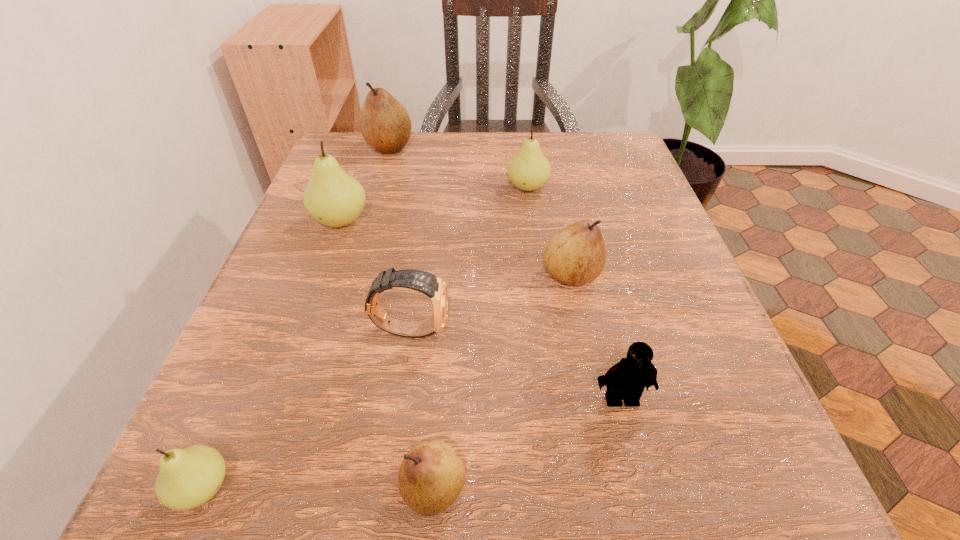
You are a GUI agent. You are given a task and a screenshot of the screen. Output one action in this format:
    pyautogui.click(x=<x>, y=<y>)
    Task: Click on the farthest brown pear
    
    Given the screenshot: What is the action you would take?
    pyautogui.click(x=385, y=124)

You are a GUI agent. You are given a task and a screenshot of the screen. Output one action in this format:
    pyautogui.click(x=<x>, y=<y>)
    Task: Click on the farthest pear
    
    Given the screenshot: What is the action you would take?
    pyautogui.click(x=385, y=124)

Locate an element on the screen. The image size is (960, 540). the fourth nearest pear is located at coordinates (332, 197).

Image resolution: width=960 pixels, height=540 pixels. Find the location of `the biggest green pear`. the biggest green pear is located at coordinates (332, 197).

Where is `the fifth nearest pear`? the fifth nearest pear is located at coordinates (528, 170).

Identify the location of the rightmost green pear. pyautogui.click(x=528, y=170).

You are a GUI agent. You are given a task and a screenshot of the screen. Output one action in this format:
    pyautogui.click(x=<x>, y=<y>)
    Task: Click on the rightmost brown pear
    
    Given the screenshot: What is the action you would take?
    pyautogui.click(x=576, y=254)

Identify the location of the second nearest brown pear. The width and height of the screenshot is (960, 540). (576, 254).

Identify the location of gold watch. This screenshot has height=540, width=960. (427, 283).

Where is `watch`? The width and height of the screenshot is (960, 540). watch is located at coordinates (427, 283).